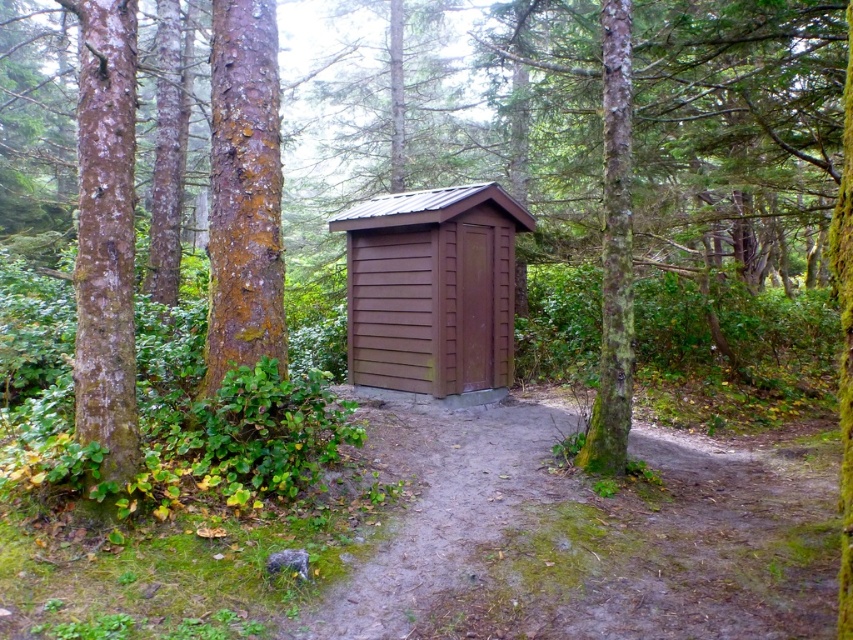
Question: Which of the following is the farthest from the observer?

Choices:
 (A) (239, 99)
 (B) (624, 44)
 (C) (473, 230)
 (D) (100, 307)

Answer: (C)

Question: Which point is farther to the camera?

Choices:
 (A) brown dirt path at center
 (B) green mossy tree trunk at center
 (C) smooth brown bark at center

Answer: (B)

Question: Which object is farther from the camera taking this photo?

Choices:
 (A) brown wood shed at center
 (B) smooth brown bark at left

Answer: (A)

Question: Does brown wood shed at center have a larger size compared to green mossy tree trunk at center?

Choices:
 (A) no
 (B) yes

Answer: (B)

Question: Where is brown dirt path at center located in relation to smooth brown bark at center in the image?

Choices:
 (A) below
 (B) above

Answer: (A)

Question: Does brown wood shed at center appear on the right side of green mossy tree trunk at center?

Choices:
 (A) yes
 (B) no

Answer: (B)